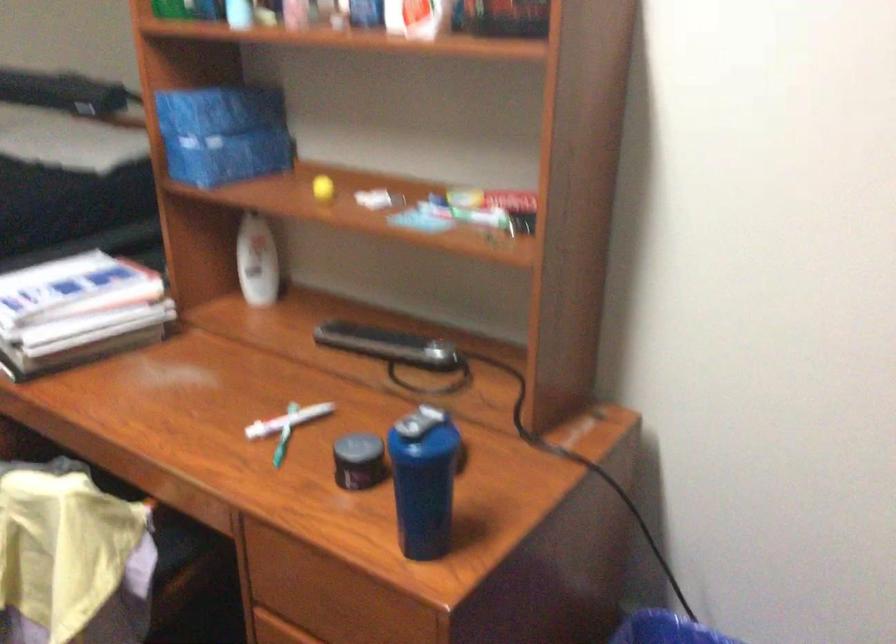
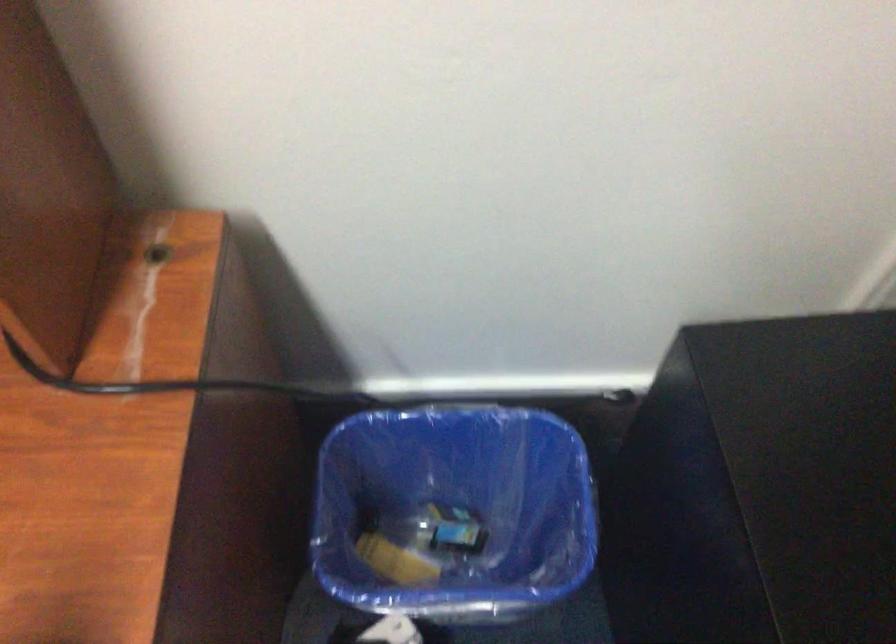
From the picture: How did the camera likely rotate?

The camera's rotation is toward right-down.